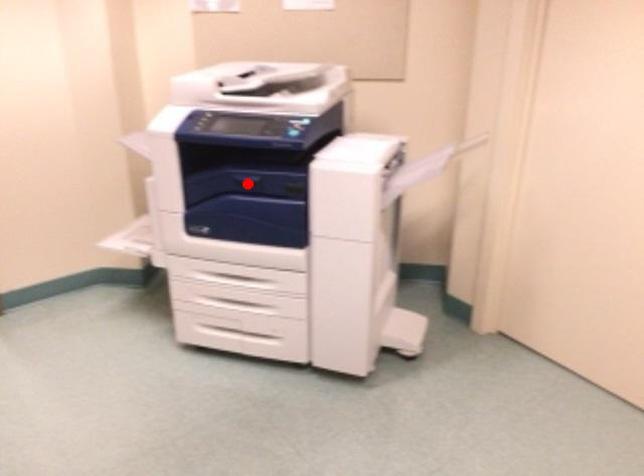
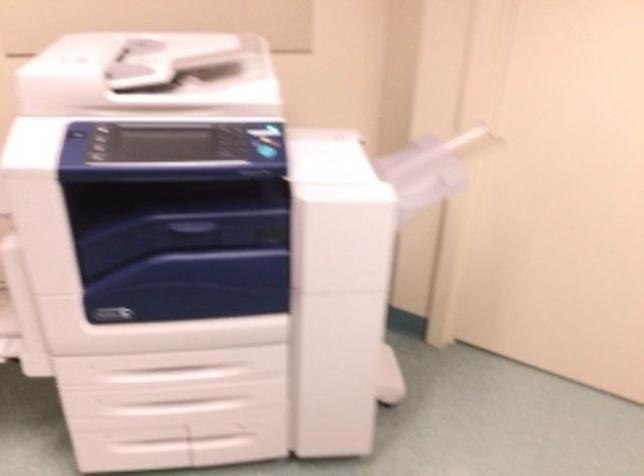
Question: I am providing you with two images of the same scene from different viewpoints. Given a red point in image1, look at the same physical point in image2. Is it:

Choices:
 (A) Closer to the viewpoint
 (B) Farther from the viewpoint

Answer: (A)